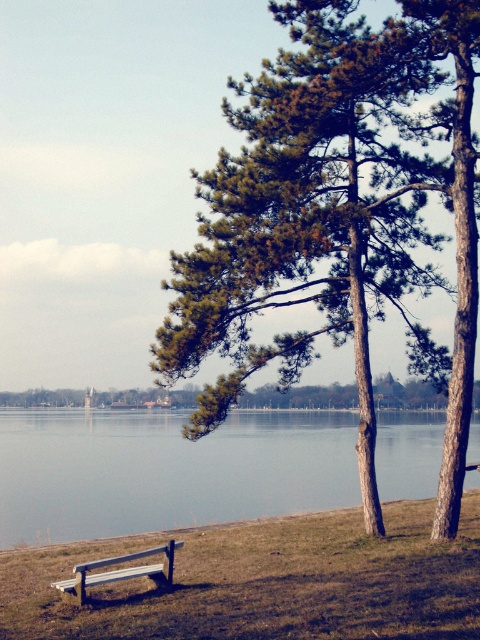
Does point (264, 74) come behind point (51, 584)?

That is True.

Does point (330, 180) lie in front of point (139, 572)?

No.

Describe the element at coordinates (337, 214) in the screenshot. I see `green needle-like leaves at center` at that location.

Find the location of `green needle-like leaves at center`. green needle-like leaves at center is located at coordinates (337, 214).

Who is taller, brown grassy at lower center or clear water at bench left?

With more height is clear water at bench left.

Is brown grassy at lower center wider than clear water at bench left?

No.

Is point (28, 630) behind point (60, 435)?

No, (28, 630) is closer to viewer.

At what (x,y) coordinates should I click in order to perform the action: click on brown grassy at lower center. Please return your answer as a coordinate pair (x, y). Looking at the image, I should click on (264, 582).

Is brown grassy at lower center below wooden park bench at lower left?

Yes, brown grassy at lower center is below wooden park bench at lower left.

This screenshot has height=640, width=480. I want to click on brown grassy at lower center, so click(264, 582).